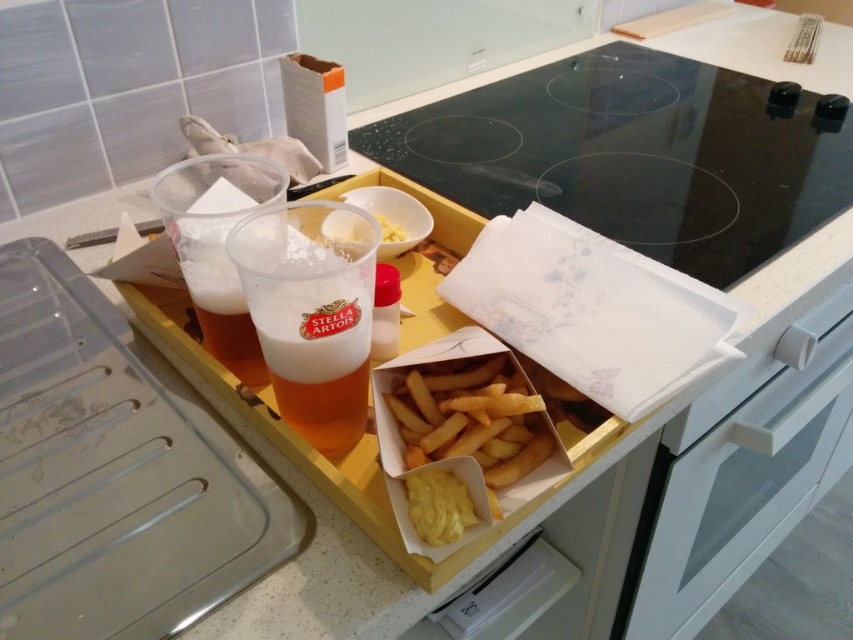
Who is more forward, [518,433] or [410,516]?

Positioned in front is point [410,516].

Is point (521, 464) farther from camera compared to point (440, 468)?

That is True.

Locate an element on the screen. golden crispy french fries at center is located at coordinates (469, 417).

Which of these two, white glossy drawer at lower right or golden crispy french fries at center, stands taller?

white glossy drawer at lower right

Can you confirm if white glossy drawer at lower right is thinner than golden crispy french fries at center?

Incorrect, white glossy drawer at lower right's width is not less than golden crispy french fries at center's.

Is point (641, 564) more distant than point (471, 381)?

Yes, it is.

Locate an element on the screen. white glossy drawer at lower right is located at coordinates (743, 490).

Who is positioned more to the left, white glossy drawer at lower right or yellow creamy spread at lower center?

yellow creamy spread at lower center is more to the left.

Which is more to the right, white glossy drawer at lower right or yellow creamy spread at lower center?

white glossy drawer at lower right

Between point (671, 609) and point (456, 481), which one is positioned in front?

Point (456, 481)

Image resolution: width=853 pixels, height=640 pixels. I want to click on white glossy drawer at lower right, so click(743, 490).